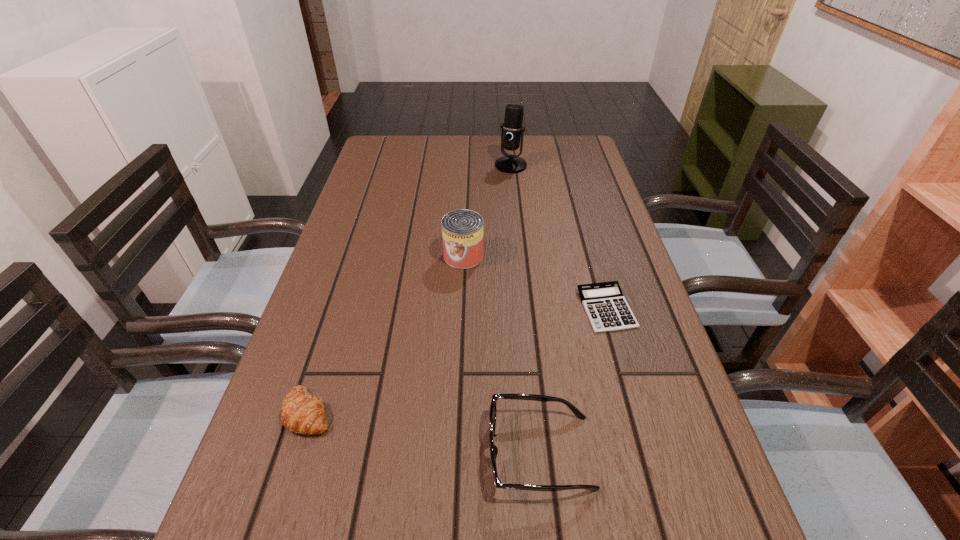
Locate an element on the screen. The height and width of the screenshot is (540, 960). empty space that is in between the third tallest object and the crescent roll is located at coordinates (424, 432).

Image resolution: width=960 pixels, height=540 pixels. Identify the location of unoccupied position between the fourth tallest object and the calculator. (458, 360).

Identify the location of free point between the shortest object and the third shortest object. (573, 380).

Locate an element on the screen. Image resolution: width=960 pixels, height=540 pixels. object that is the third closest to the farthest object is located at coordinates (493, 408).

The image size is (960, 540). Find the location of `the closest object relative to the second shortest object`. the closest object relative to the second shortest object is located at coordinates (493, 408).

Locate an element on the screen. This screenshot has height=540, width=960. blank space that satisfies the following two spatial constraints: 1. on the front side of the calculator; 2. on the right side of the fourth shortest object is located at coordinates pyautogui.click(x=462, y=308).